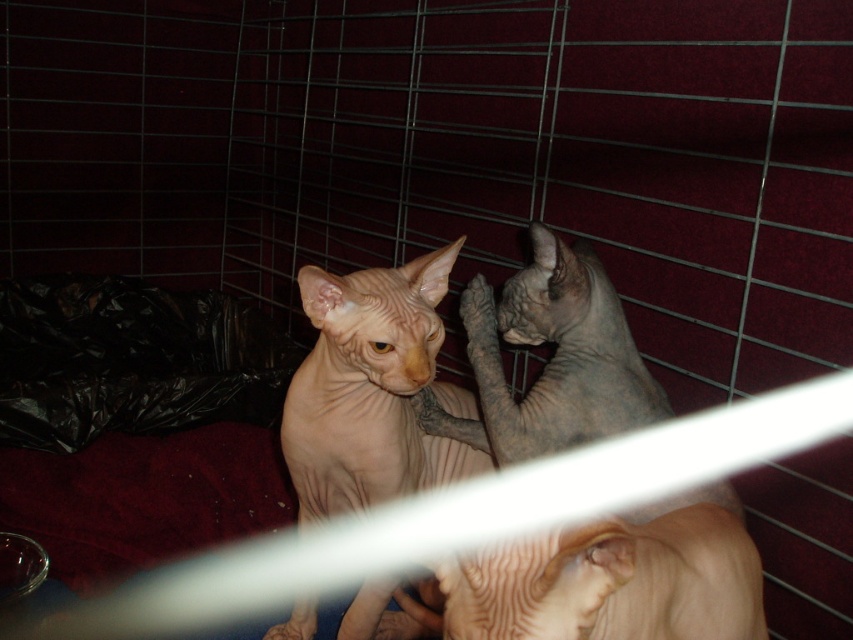
Can you confirm if gray textured cat at center is positioned to the left of smooth beige cat at center?

In fact, gray textured cat at center is to the right of smooth beige cat at center.

You are a GUI agent. You are given a task and a screenshot of the screen. Output one action in this format:
    pyautogui.click(x=<x>, y=<y>)
    Task: Click on the gray textured cat at center
    This screenshot has width=853, height=640.
    Given the screenshot: What is the action you would take?
    [x=618, y=579]

What do you see at coordinates (618, 579) in the screenshot? The image size is (853, 640). I see `gray textured cat at center` at bounding box center [618, 579].

The height and width of the screenshot is (640, 853). Identify the location of gray textured cat at center. (618, 579).